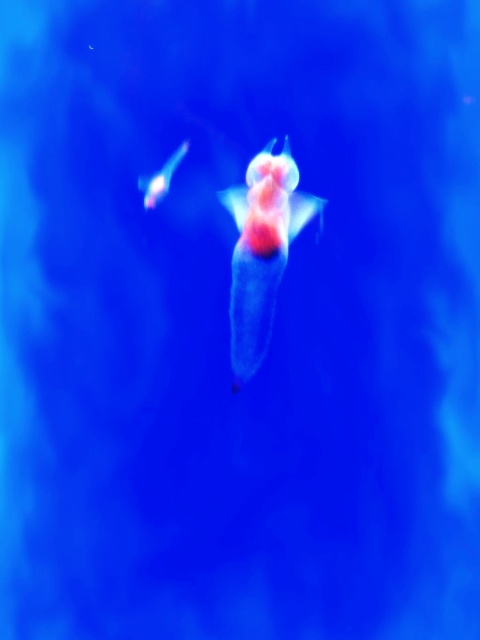
You are an underwater photographer aiming to capture both the translucent blue fish at center and the matte pink fish at upper left in a single frame. Given their positions and sizes, which fish will appear larger in your photo?

The translucent blue fish at center will appear larger in the photo because it is much taller than the matte pink fish at upper left.

Looking at this image, you are an underwater photographer aiming to capture both the translucent blue fish at center and the matte pink fish at upper left in a single frame. Given their sizes and positions, which fish should you focus on first to ensure both are in focus?

The translucent blue fish at center is larger than the matte pink fish at upper left, so focusing on the translucent blue fish at center first would help ensure both are in focus as it requires a closer focus distance.